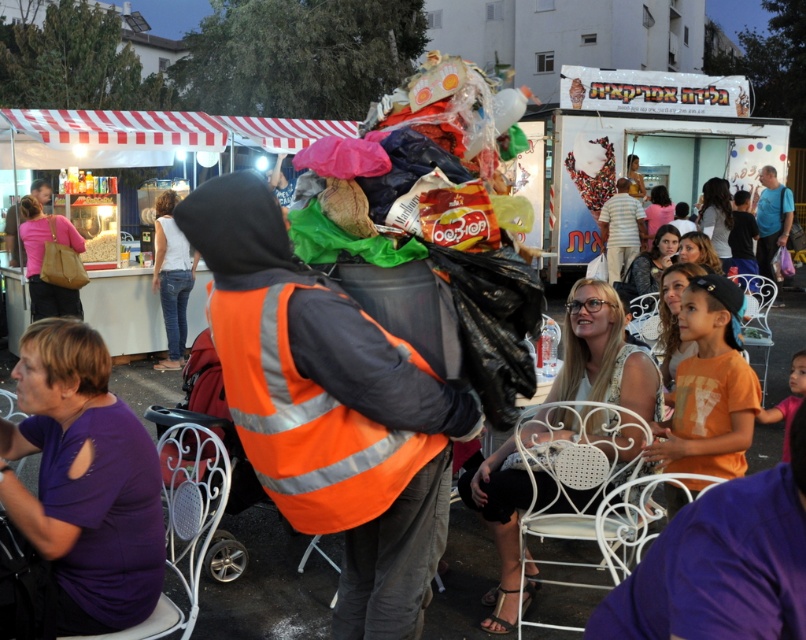
Who is positioned more to the left, white cardboard food truck at center or striped cotton shirt at center?

striped cotton shirt at center is more to the left.

Who is positioned more to the right, white cardboard food truck at center or striped cotton shirt at center?

Positioned to the right is white cardboard food truck at center.

Does point (676, 93) come closer to viewer compared to point (613, 216)?

No, it is not.

Locate an element on the screen. white cardboard food truck at center is located at coordinates (649, 144).

Does orange reflective vest at center have a greater height compared to striped cotton shirt at center?

No, orange reflective vest at center is not taller than striped cotton shirt at center.

The image size is (806, 640). What do you see at coordinates (327, 406) in the screenshot?
I see `orange reflective vest at center` at bounding box center [327, 406].

Find the location of a particular element. Image resolution: width=806 pixels, height=640 pixels. orange reflective vest at center is located at coordinates point(327,406).

Is orange reflective vest at center below white cardboard food truck at center?

Correct, orange reflective vest at center is located below white cardboard food truck at center.

Is orange reflective vest at center to the right of white cardboard food truck at center from the viewer's perspective?

Incorrect, orange reflective vest at center is not on the right side of white cardboard food truck at center.

In order to click on orange reflective vest at center in this screenshot , I will do coord(327,406).